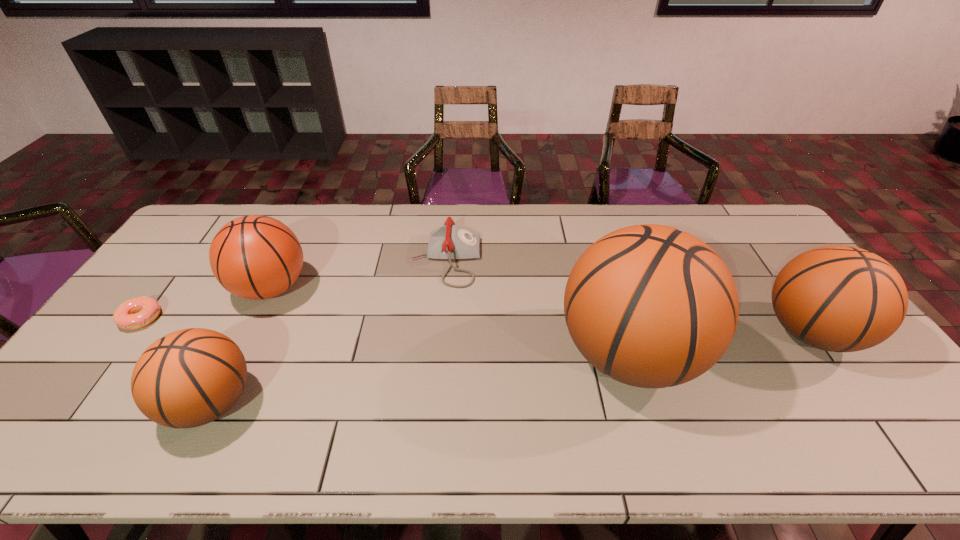
Locate an element on the screen. the tallest object is located at coordinates (651, 306).

Identify the location of the third basketball from left to right. (651, 306).

Where is `the rightmost object`? the rightmost object is located at coordinates (836, 298).

This screenshot has height=540, width=960. What are the coordinates of `telephone` in the screenshot? It's located at (449, 242).

Identify the location of the fifth tallest object. (449, 242).

Locate an element on the screen. The width and height of the screenshot is (960, 540). the leftmost object is located at coordinates (135, 313).

Image resolution: width=960 pixels, height=540 pixels. I want to click on the shortest object, so click(x=135, y=313).

Where is `vacant region located on the left of the second basketball from right to left`? vacant region located on the left of the second basketball from right to left is located at coordinates (406, 353).

The height and width of the screenshot is (540, 960). Identify the location of vacant space located 0.060m on the front of the rightmost basketball. (853, 394).

I want to click on vacant area situated 0.380m on the dial of the telephone, so click(x=595, y=260).